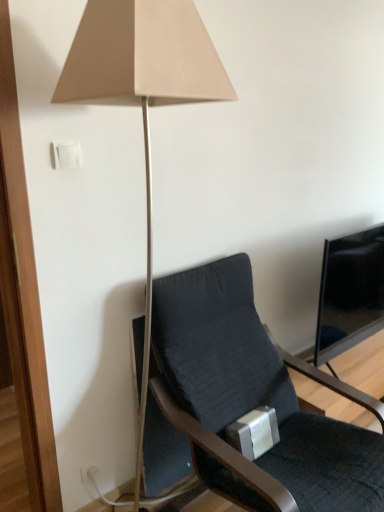
Question: In terms of size, does dark gray fabric chair at center appear bigger or smaller than matte beige lamp at upper center?

Choices:
 (A) small
 (B) big

Answer: (B)

Question: Considering the positions of dark gray fabric chair at center and matte beige lamp at upper center in the image, is dark gray fabric chair at center taller or shorter than matte beige lamp at upper center?

Choices:
 (A) tall
 (B) short

Answer: (B)

Question: Considering the real-world distances, which object is farthest from the matte beige lamp at upper center?

Choices:
 (A) dark gray fabric chair at center
 (B) white plastic light switch at upper left
 (C) black glossy screen at right

Answer: (C)

Question: Based on their relative distances, which object is nearer to the matte beige lamp at upper center?

Choices:
 (A) white plastic light switch at upper left
 (B) dark gray fabric chair at center
 (C) black glossy screen at right

Answer: (A)